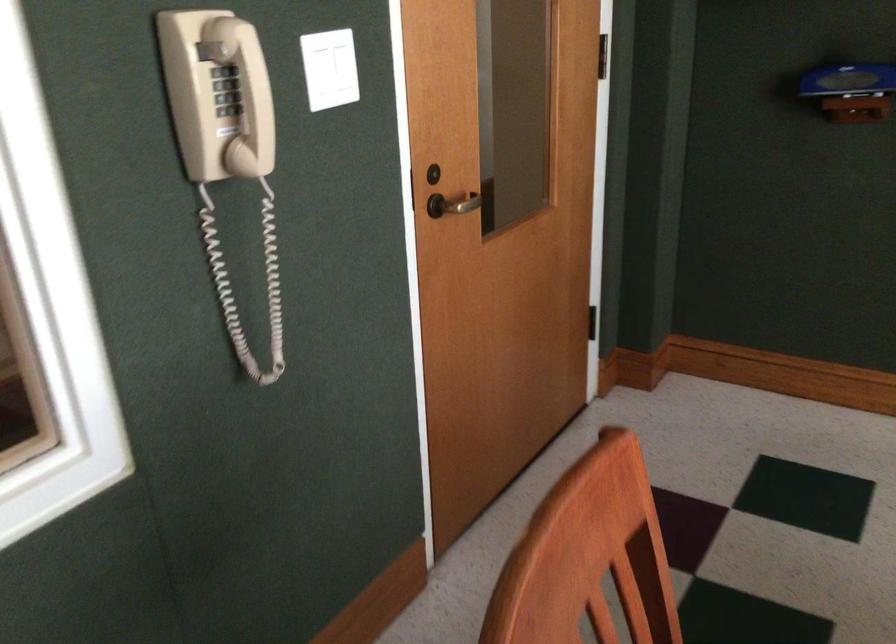
At what (x,y) coordinates should I click in order to perform the action: click on telephone button. Please return your answer as a coordinate pair (x, y). The image size is (896, 644). Looking at the image, I should click on click(x=226, y=90).